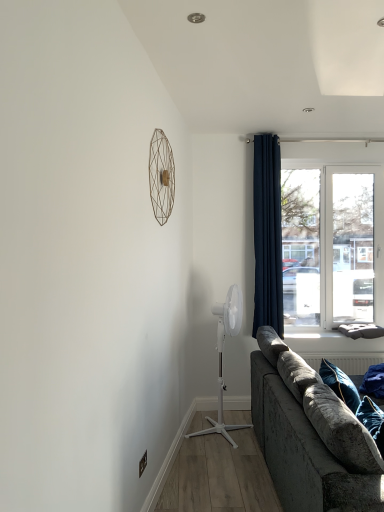
Identify the location of blank space situated above navy blue fabric curtain at right (from a real-world perspective). (264, 125).